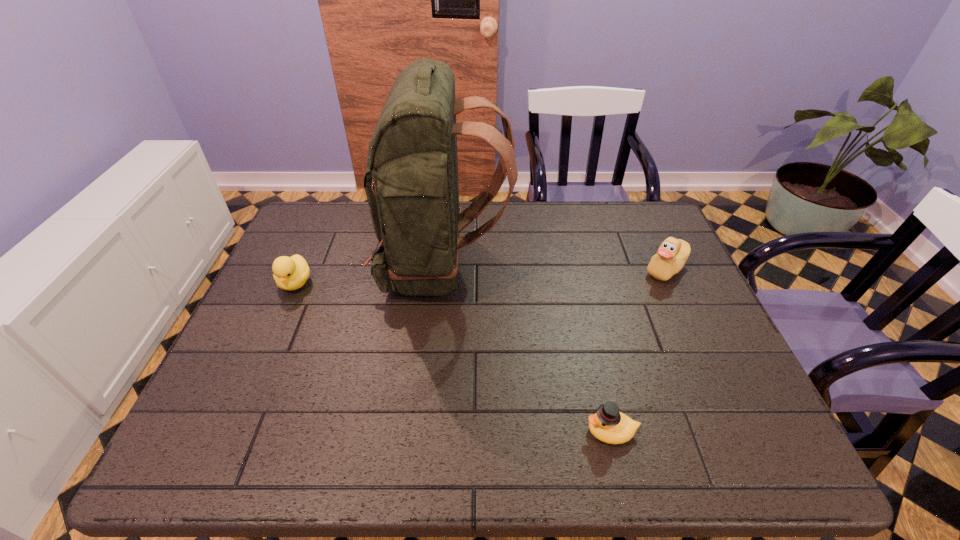
You are a GUI agent. You are given a task and a screenshot of the screen. Output one action in this format:
    pyautogui.click(x=<x>, y=<y>)
    Task: Click on the backpack
    Image resolution: width=960 pixels, height=540 pixels.
    Given the screenshot: What is the action you would take?
    411,182

This screenshot has height=540, width=960. I want to click on the tallest object, so click(411, 182).

This screenshot has width=960, height=540. What are the coordinates of `the rightmost duck` in the screenshot? It's located at (672, 254).

Find the location of a particular element. the leftmost duck is located at coordinates (290, 273).

This screenshot has width=960, height=540. In order to click on the leftmost object in this screenshot , I will do `click(290, 273)`.

The height and width of the screenshot is (540, 960). I want to click on the shortest duck, so click(608, 425).

The height and width of the screenshot is (540, 960). I want to click on the second duck from right to left, so tap(608, 425).

Image resolution: width=960 pixels, height=540 pixels. In order to click on vacant space located on the back of the backpack in this screenshot , I will do `click(548, 266)`.

The image size is (960, 540). In order to click on vacant space located at the beak of the rightmost object in this screenshot , I will do `click(516, 269)`.

I want to click on free location located at the beak of the rightmost object, so click(548, 269).